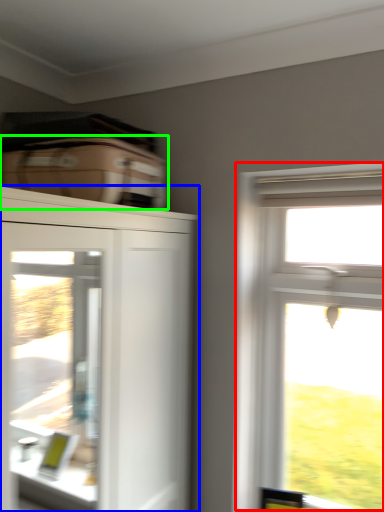
Question: Which object is the closest to the window (highlighted by a red box)? Choose among these: cupboard (highlighted by a blue box) or suitcase (highlighted by a green box).

Choices:
 (A) cupboard
 (B) suitcase

Answer: (B)